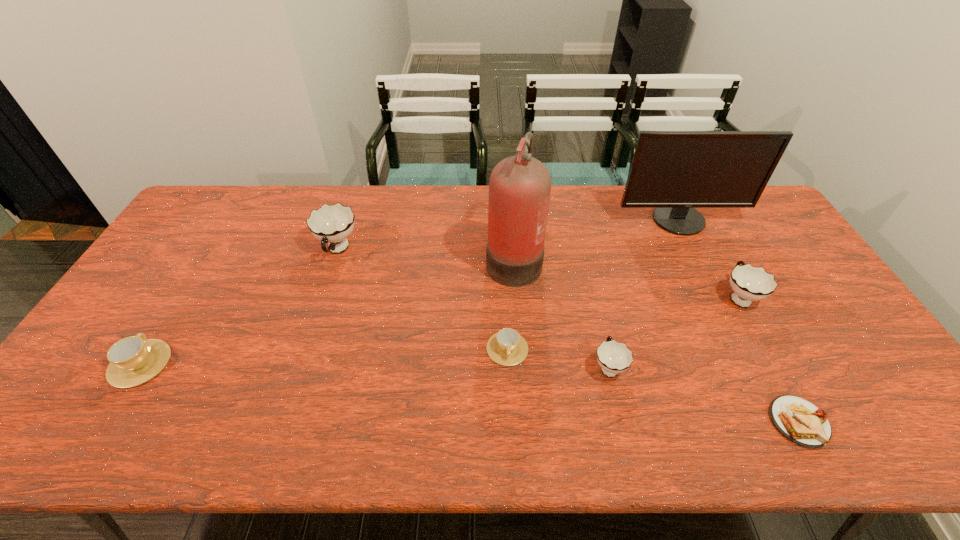
Where is `free spot located on the right of the sandwich`? free spot located on the right of the sandwich is located at coordinates (897, 422).

Find the location of `object present at the far edge`. object present at the far edge is located at coordinates (674, 172).

Find the location of a particular element. object that is at the near edge is located at coordinates (800, 421).

At what (x,y) coordinates should I click in order to perform the action: click on object positioned at the left edge. Please return your answer as a coordinate pair (x, y). Looking at the image, I should click on (133, 360).

Identify the location of object that is positioned at the right edge. (674, 172).

Find the location of `object located in the far right corner section of the desktop`. object located in the far right corner section of the desktop is located at coordinates (674, 172).

You are a GUI agent. You are given a task and a screenshot of the screen. Output one action in this format:
    pyautogui.click(x=<x>, y=<y>)
    Task: Click on the vacant region at the near edge
    
    Given the screenshot: What is the action you would take?
    pyautogui.click(x=363, y=444)

The width and height of the screenshot is (960, 540). In order to click on vacant space at the left edge in this screenshot , I will do `click(134, 335)`.

The image size is (960, 540). In the image, there is a desktop. In order to click on free space at the right edge in this screenshot , I will do `click(852, 379)`.

In the image, there is a desktop. Find the location of `vacant region at the far right corner`. vacant region at the far right corner is located at coordinates (738, 226).